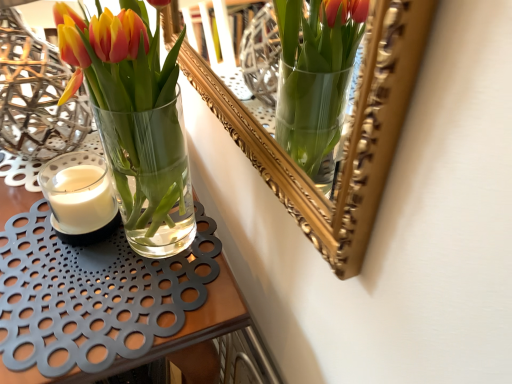
Where is `vacant space to the left of white matte candle at left`? The width and height of the screenshot is (512, 384). vacant space to the left of white matte candle at left is located at coordinates (24, 205).